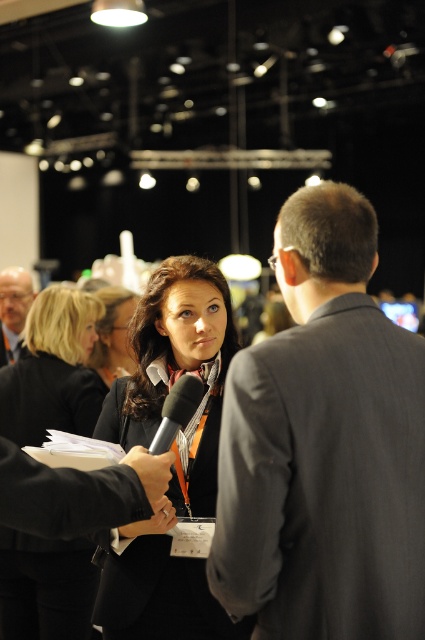
Who is positioned more to the right, dark brown leather jacket at center or black matte microphone at center?

black matte microphone at center is more to the right.

Is dark brown leather jacket at center above black matte microphone at center?

No, dark brown leather jacket at center is not above black matte microphone at center.

This screenshot has width=425, height=640. Describe the element at coordinates (175, 452) in the screenshot. I see `dark brown leather jacket at center` at that location.

Find the location of a particular element. dark brown leather jacket at center is located at coordinates (175, 452).

Based on the photo, who is positioned more to the left, dark brown leather jacket at center or matte black suit at left?

From the viewer's perspective, matte black suit at left appears more on the left side.

Is dark brown leather jacket at center thinner than matte black suit at left?

No.

Locate an element on the screen. The width and height of the screenshot is (425, 640). dark brown leather jacket at center is located at coordinates (175, 452).

Locate an element on the screen. dark brown leather jacket at center is located at coordinates (175, 452).

Does matte black hair at center appear over matte black suit at left?

Actually, matte black hair at center is below matte black suit at left.

Is matte black hair at center wider than matte black suit at left?

In fact, matte black hair at center might be narrower than matte black suit at left.

Who is more distant from viewer, (104,296) or (25,282)?

Positioned behind is point (25,282).

Locate an element on the screen. The height and width of the screenshot is (640, 425). matte black hair at center is located at coordinates (113, 333).